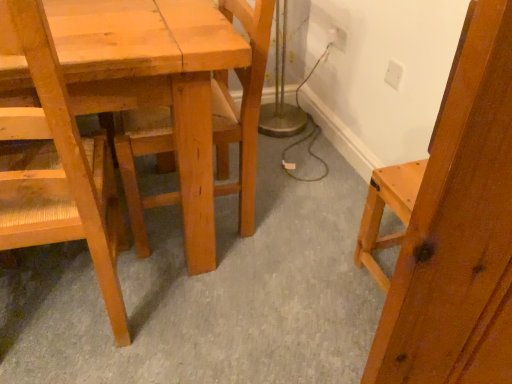
At what (x,y) coordinates should I click in order to perform the action: click on free spot below natural wood chair at left, the second chair positioned from the right (from a real-world perspective). Please return your answer as a coordinate pair (x, y). Looking at the image, I should click on (55, 311).